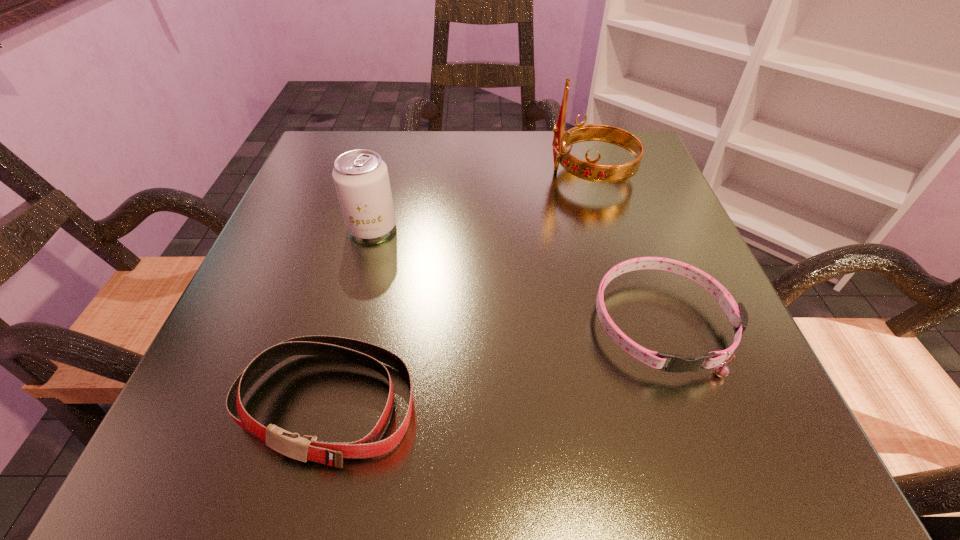
Locate which object ranks in proximity to the second tallest object. Please provide its 2D coordinates. Your answer should be formatted as a tuple, i.e. [(x, y)], where the tuple contains the x and y coordinates of a point satisfying the conditions above.

[(304, 448)]